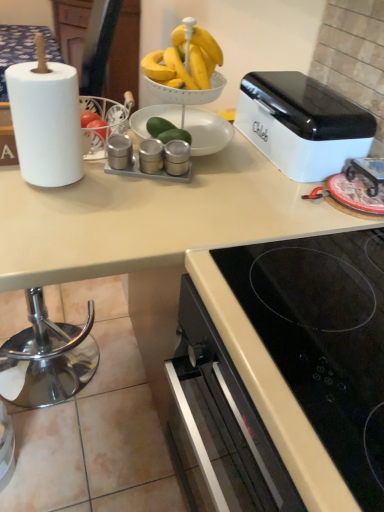
Question: From the image's perspective, is black glass cooktop at lower right located beneath satin silver salt and pepper shakers at center, which ranks as the second appliance in left-to-right order?

Choices:
 (A) yes
 (B) no

Answer: (A)

Question: Is black glass cooktop at lower right closer to the viewer compared to satin silver salt and pepper shakers at center, which ranks as the second appliance in left-to-right order?

Choices:
 (A) no
 (B) yes

Answer: (B)

Question: Would you say black glass cooktop at lower right is outside satin silver salt and pepper shakers at center, which ranks as the second appliance in left-to-right order?

Choices:
 (A) yes
 (B) no

Answer: (A)

Question: Can you confirm if black glass cooktop at lower right is taller than satin silver salt and pepper shakers at center, the 2th appliance in the right-to-left sequence?

Choices:
 (A) no
 (B) yes

Answer: (B)

Question: Does black glass cooktop at lower right have a greater width compared to satin silver salt and pepper shakers at center, which ranks as the second appliance in left-to-right order?

Choices:
 (A) yes
 (B) no

Answer: (A)

Question: Could you tell me if black glass cooktop at lower right is facing satin silver salt and pepper shakers at center, which ranks as the second appliance in left-to-right order?

Choices:
 (A) yes
 (B) no

Answer: (B)

Question: Can you confirm if metallic silver spice containers at center, marked as the 1th appliance in a left-to-right arrangement, is smaller than black glass cooktop at lower right?

Choices:
 (A) no
 (B) yes

Answer: (B)

Question: Considering the relative positions of metallic silver spice containers at center, marked as the 1th appliance in a left-to-right arrangement, and black glass cooktop at lower right in the image provided, is metallic silver spice containers at center, marked as the 1th appliance in a left-to-right arrangement, in front of black glass cooktop at lower right?

Choices:
 (A) no
 (B) yes

Answer: (A)

Question: Is metallic silver spice containers at center, acting as the third appliance starting from the right, at the right side of black glass cooktop at lower right?

Choices:
 (A) yes
 (B) no

Answer: (B)

Question: Is metallic silver spice containers at center, marked as the 1th appliance in a left-to-right arrangement, not within black glass cooktop at lower right?

Choices:
 (A) no
 (B) yes

Answer: (B)

Question: Is metallic silver spice containers at center, acting as the third appliance starting from the right, aimed at black glass cooktop at lower right?

Choices:
 (A) yes
 (B) no

Answer: (B)

Question: Can you confirm if metallic silver spice containers at center, marked as the 1th appliance in a left-to-right arrangement, is wider than black glass cooktop at lower right?

Choices:
 (A) no
 (B) yes

Answer: (A)

Question: From a real-world perspective, is white matte paper towel at left positioned under satin silver salt and pepper shakers at center, which ranks as the second appliance in left-to-right order, based on gravity?

Choices:
 (A) yes
 (B) no

Answer: (B)